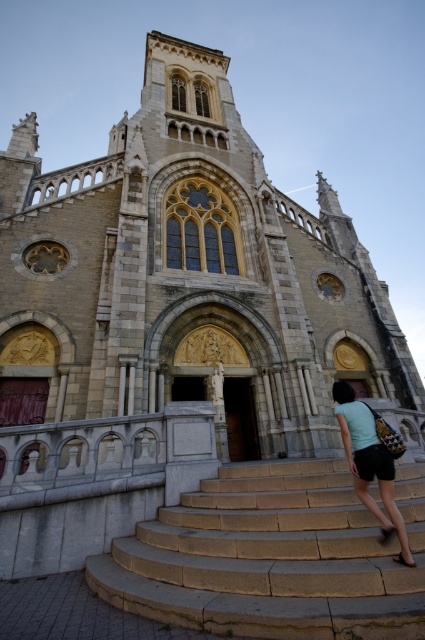
You are standing at the base of the stone stairs at center in front of the historic church. You want to place a decorative light that is 1.2 meters wide on the light blue fabric at center. Will the light fit on the fabric without overlapping the stairs?

The stone stairs at center and light blue fabric at center are 8.71 meters apart. Since the distance between them is greater than the light width of 1.2 meters, the decorative light can be placed on the light blue fabric at center without overlapping the stairs.

You are a visitor approaching the historic church and see the stone stairs at center and the light blue fabric at center. Which object appears larger in the image?

The light blue fabric at center appears larger than the stone stairs at center.